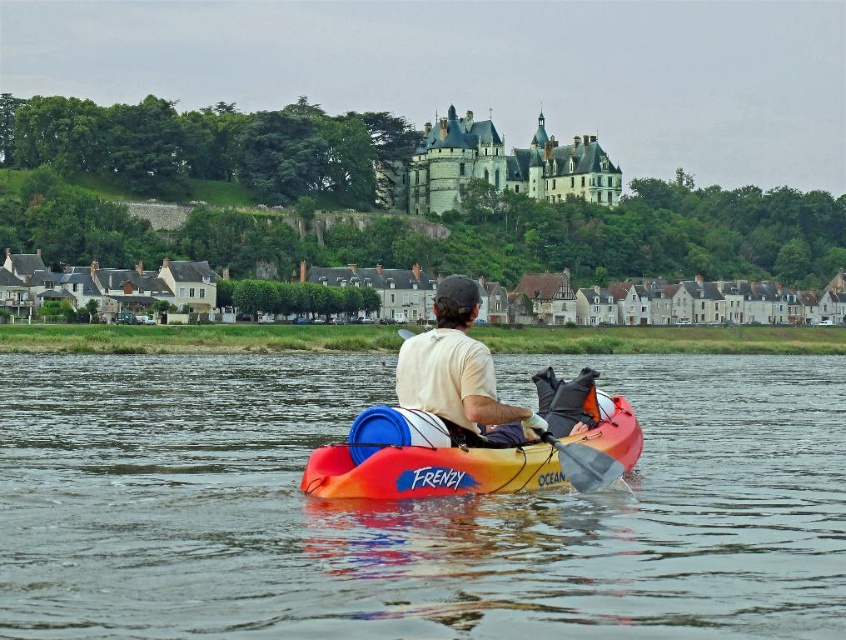
Question: Does orange/yellow plastic kayak at center have a smaller size compared to gray fabric paddle at center?

Choices:
 (A) no
 (B) yes

Answer: (A)

Question: Which object is farther from the camera taking this photo?

Choices:
 (A) stone gray castle at upper center
 (B) gray fabric paddle at center

Answer: (A)

Question: Does stone gray castle at upper center lie behind gray fabric paddle at center?

Choices:
 (A) no
 (B) yes

Answer: (B)

Question: Among these points, which one is nearest to the camera?

Choices:
 (A) (454, 369)
 (B) (589, 451)

Answer: (B)

Question: Observing the image, what is the correct spatial positioning of orange kayak at center in reference to orange/yellow plastic kayak at center?

Choices:
 (A) below
 (B) above

Answer: (B)

Question: Among these objects, which one is farthest from the camera?

Choices:
 (A) white fabric shirt at center
 (B) gray fabric paddle at center
 (C) stone gray castle at upper center

Answer: (C)